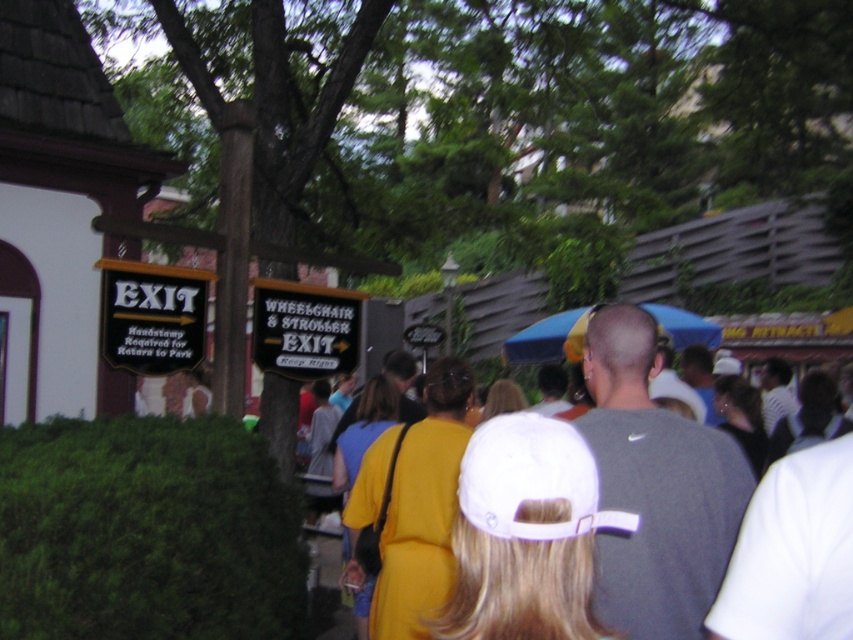
You are a person of average height standing in the park scene. You notice the green leafy hedge at lower left and the gray matte shirt at center. Which object is taller?

The green leafy hedge at lower left is taller than the gray matte shirt at center.

You are standing at the center of the image and want to find the green leafy hedge at lower left. In which direction should you look to locate it?

The green leafy hedge at lower left is located at point 0.833 on the x and 0.172 on the y axis, so you should look to the lower left direction to find it.